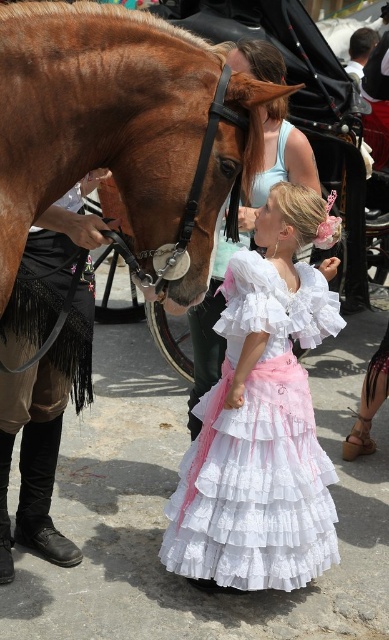
You are standing in front of the scene and want to determine which of the two points, point (236,81) or point (285,477), is closer to you. Based on the image, which point is nearer?

Point (236,81) is closer to the camera than point (285,477), so it is the nearer one.

You are a photographer trying to capture the shiny brown horse at left and the matte white blouse at center in a single shot. Which object should you focus on first to ensure both are in frame?

The shiny brown horse at left is in front of the matte white blouse at center, so you should focus on the shiny brown horse at left first to ensure both are in frame.